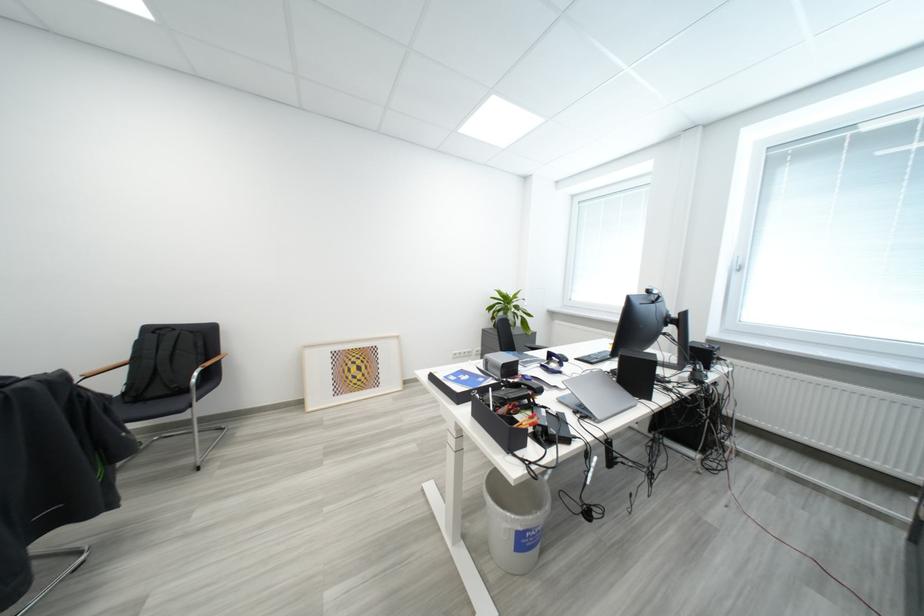
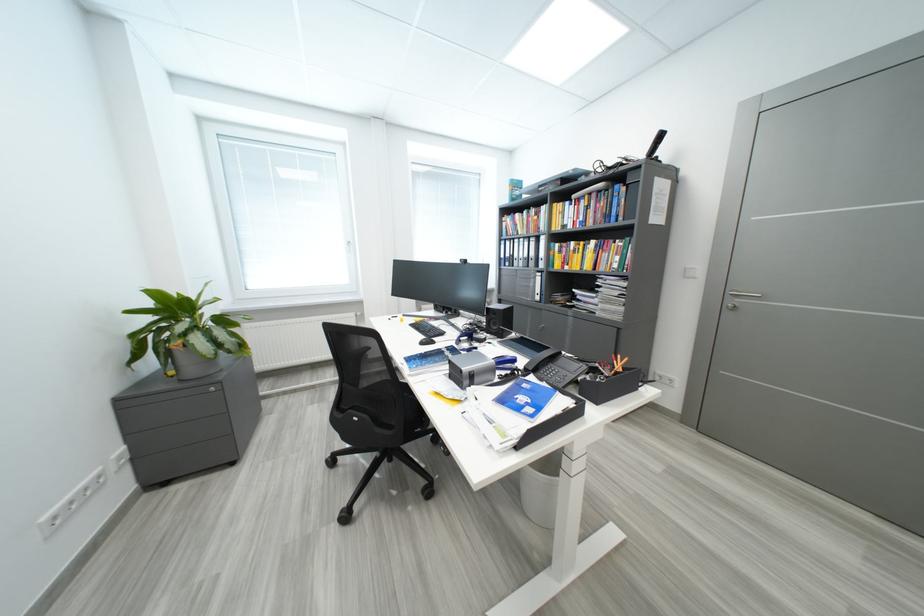
Find the pixel in the second image that matches point (506, 310) in the first image.

(189, 331)